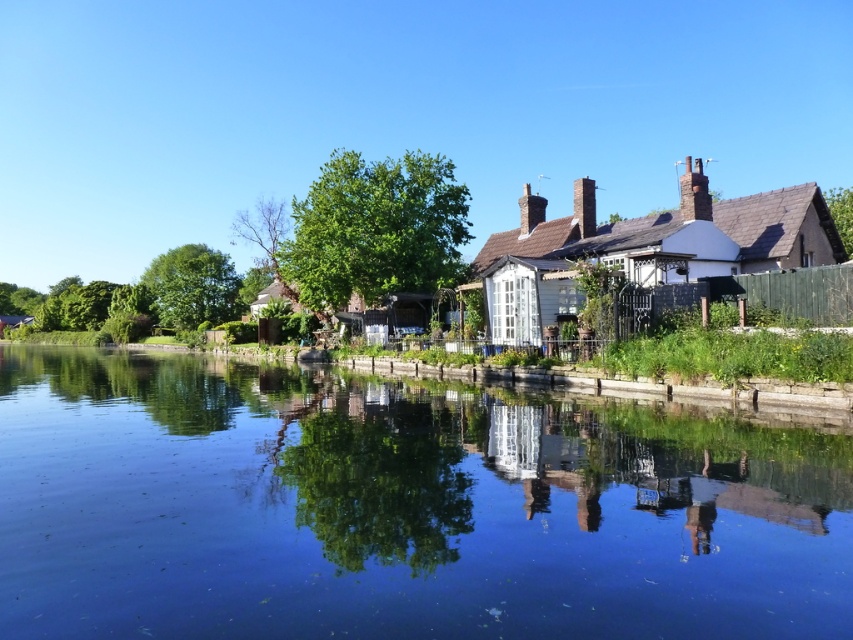
Is point (724, 534) closer to viewer compared to point (184, 320)?

That is True.

Locate an element on the screen. transparent blue water at center is located at coordinates (399, 508).

Who is higher up, green leafy tree at left or green leafy tree at upper right?

green leafy tree at upper right

Between green leafy tree at left and green leafy tree at upper right, which one appears on the right side from the viewer's perspective?

green leafy tree at upper right

Is point (213, 288) positioned before point (849, 211)?

No, (213, 288) is further to viewer.

At what (x,y) coordinates should I click in order to perform the action: click on green leafy tree at left. Please return your answer as a coordinate pair (x, y). This screenshot has height=640, width=853. Looking at the image, I should click on (193, 285).

Is transparent blue water at center to the left of green leafy tree at center from the viewer's perspective?

In fact, transparent blue water at center is to the right of green leafy tree at center.

How distant is transparent blue water at center from green leafy tree at center?

transparent blue water at center is 58.98 feet from green leafy tree at center.

What are the coordinates of `transparent blue water at center` in the screenshot? It's located at (399, 508).